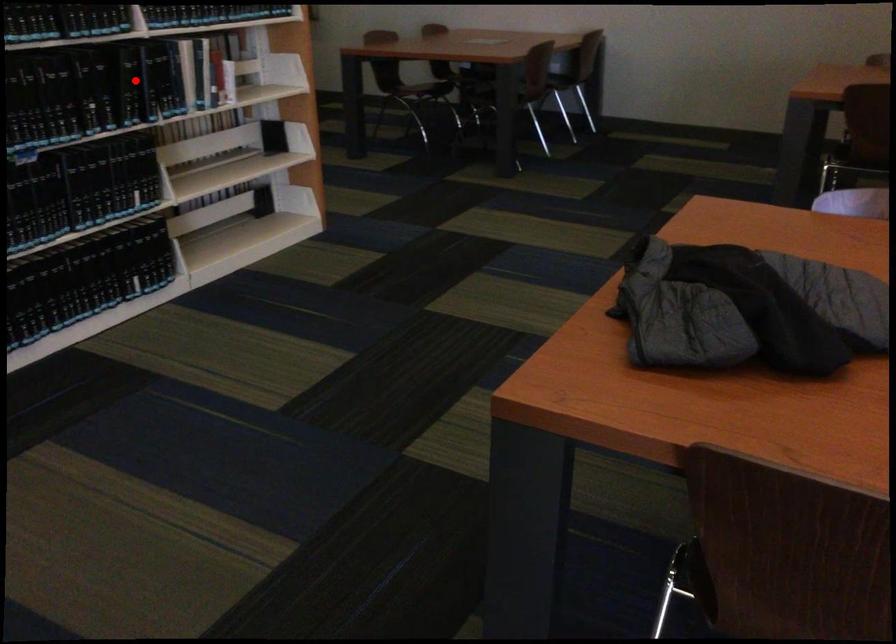
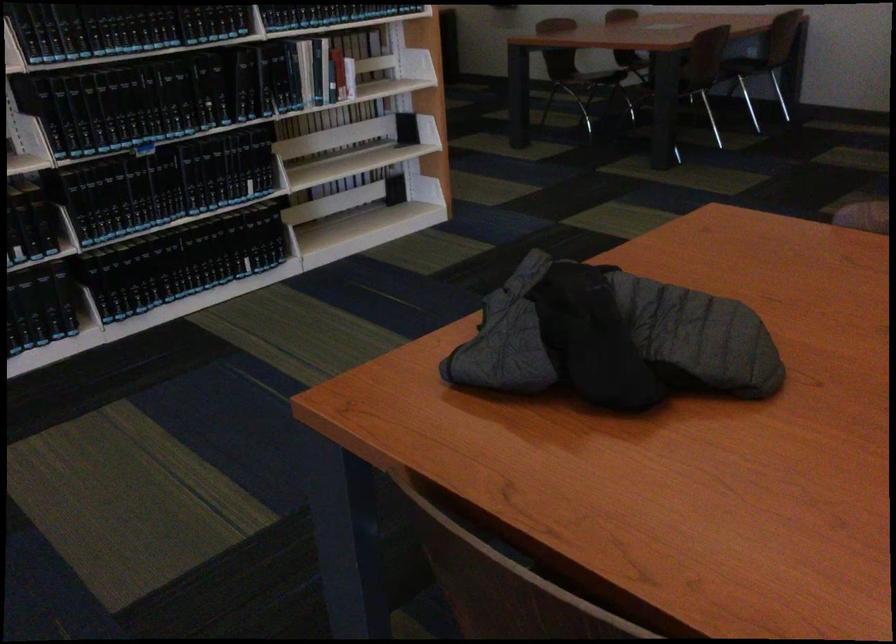
In the second image, find the point that corresponds to the highlighted location in the first image.

(248, 82)